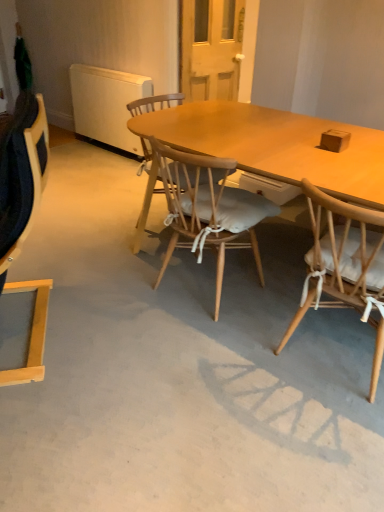
I want to click on free space in front of wooden chair with cushion at center, arranged as the second chair when viewed from the left, so click(x=199, y=345).